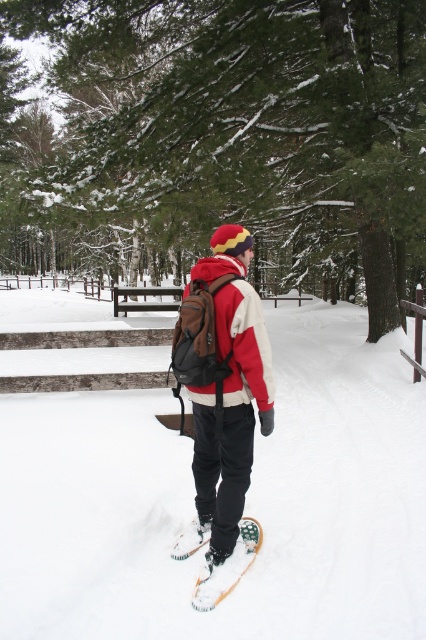
Which is above, white fluffy snow at center or green textured tree at center?

green textured tree at center

Does white fluffy snow at center lie in front of green textured tree at center?

Yes, white fluffy snow at center is in front of green textured tree at center.

Measure the distance between white fluffy snow at center and camera.

white fluffy snow at center is 9.48 feet away from camera.

Find the location of a particular element. The width and height of the screenshot is (426, 640). white fluffy snow at center is located at coordinates (244, 504).

In the scene shown: Is green textured tree at center wider than red fleece jacket at center?

Correct, the width of green textured tree at center exceeds that of red fleece jacket at center.

Who is more distant from viewer, [181,24] or [222,296]?

The point [181,24] is more distant.

Between point (328, 92) and point (184, 294), which one is positioned behind?

Positioned behind is point (328, 92).

Locate an element on the screen. The height and width of the screenshot is (640, 426). green textured tree at center is located at coordinates (230, 134).

Between green textured tree at center and matte brown backpack at center, which one has less height?

With less height is matte brown backpack at center.

Is green textured tree at center to the left of matte brown backpack at center from the viewer's perspective?

Indeed, green textured tree at center is positioned on the left side of matte brown backpack at center.

Where is `green textured tree at center`? The height and width of the screenshot is (640, 426). green textured tree at center is located at coordinates (230, 134).

Identify the location of green textured tree at center. (230, 134).